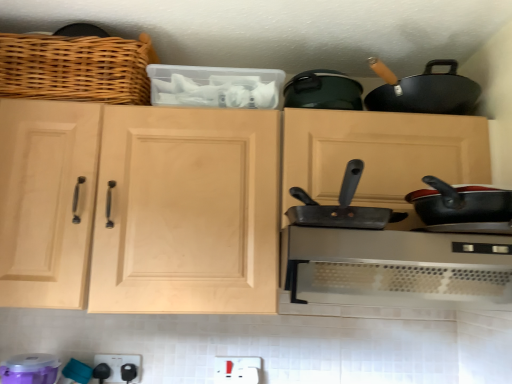
Question: Is point (343, 200) positioned closer to the camera than point (93, 96)?

Choices:
 (A) farther
 (B) closer

Answer: (B)

Question: Is metallic gray frying pan at center to the left or to the right of woven wood basket at upper left in the image?

Choices:
 (A) left
 (B) right

Answer: (B)

Question: Considering the real-world distances, which object is farthest from the natural wood cabinet at center?

Choices:
 (A) woven wood basket at upper left
 (B) purple plastic container at lower left, marked as the first appliance in a left-to-right arrangement
 (C) black plastic outlet at lower center, the 2th appliance when ordered from front to back
 (D) metallic gray frying pan at center
 (E) satin silver range hood at center

Answer: (C)

Question: Which is farther from the woven wood basket at upper left?

Choices:
 (A) natural wood cabinet at center
 (B) black plastic outlet at lower center, which is counted as the 1th appliance, starting from the back
 (C) purple plastic container at lower left, which appears as the 2th appliance when viewed from the back
 (D) satin silver range hood at center
 (E) metallic gray frying pan at center

Answer: (B)